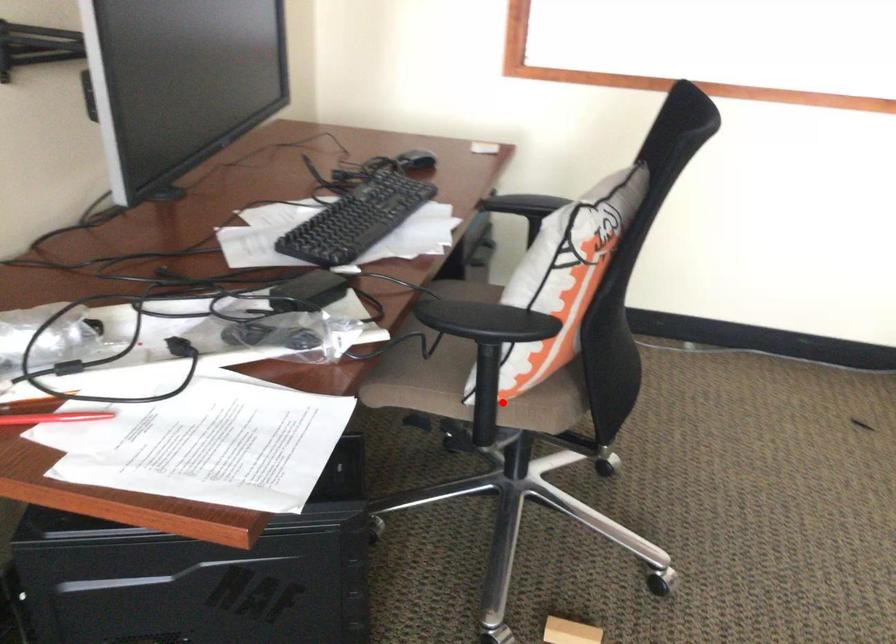
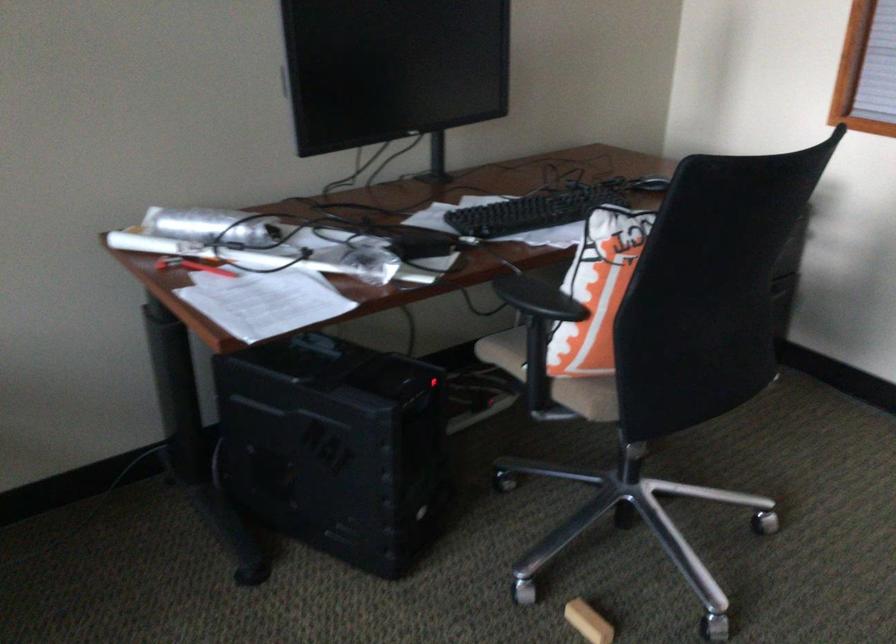
Question: A red point is marked in image1. In image2, is the corresponding 3D point closer to the camera or farther? Reply with the corresponding letter.

Choices:
 (A) The corresponding 3D point is closer.
 (B) The corresponding 3D point is farther.

Answer: (B)